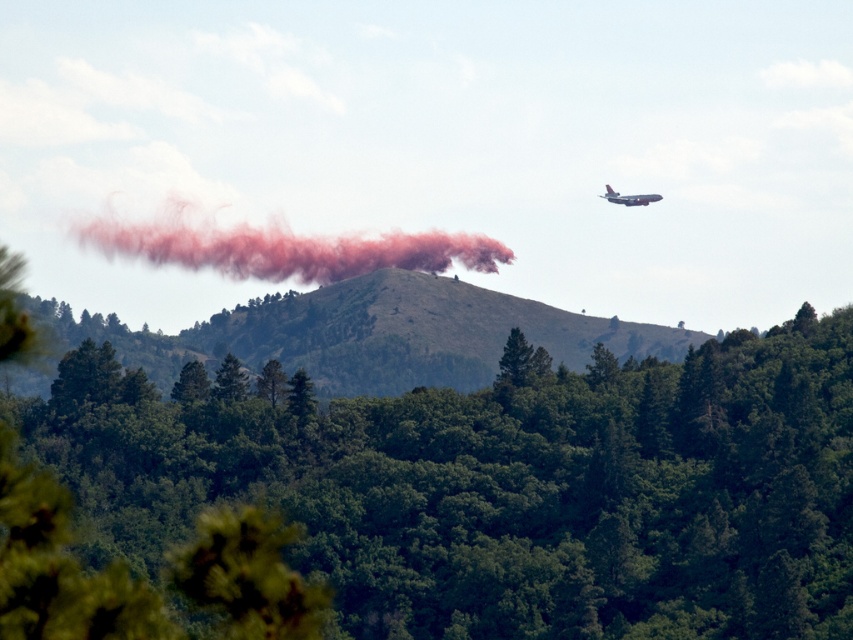
Is the position of smooth brown hill at center less distant than that of red matte smoke at center?

Yes, smooth brown hill at center is in front of red matte smoke at center.

I want to click on smooth brown hill at center, so click(x=355, y=336).

Is smooth brown hill at center wider than metallic blue airplane at upper right?

Yes.

Can you confirm if smooth brown hill at center is shorter than metallic blue airplane at upper right?

No, smooth brown hill at center is not shorter than metallic blue airplane at upper right.

Which is in front, point (42, 316) or point (602, 195)?

Point (602, 195) is more forward.

This screenshot has height=640, width=853. I want to click on smooth brown hill at center, so click(355, 336).

Can you confirm if red matte smoke at center is positioned below metallic blue airplane at upper right?

Indeed, red matte smoke at center is positioned under metallic blue airplane at upper right.

Who is positioned more to the left, red matte smoke at center or metallic blue airplane at upper right?

red matte smoke at center

Does point (171, 216) come farther from viewer compared to point (619, 196)?

That is True.

You are a GUI agent. You are given a task and a screenshot of the screen. Output one action in this format:
    pyautogui.click(x=<x>, y=<y>)
    Task: Click on the red matte smoke at center
    Image resolution: width=853 pixels, height=640 pixels.
    Given the screenshot: What is the action you would take?
    pyautogui.click(x=286, y=248)